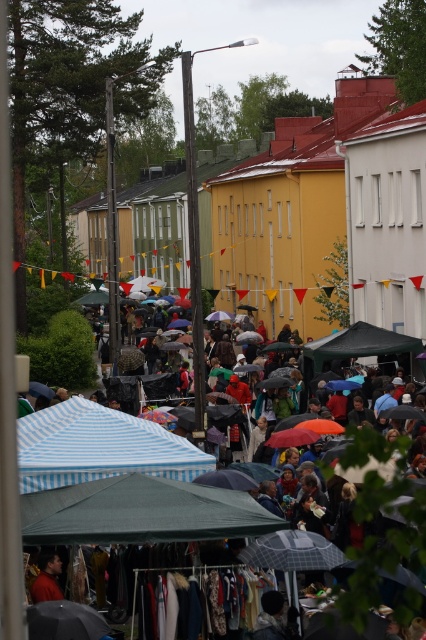
You are a customer at the market and want to buy a canopy for your own stall. You need one that is wider to cover more space. Based on the scene, which canopy should you choose between the green fabric canopy at lower center and the striped fabric tent at center?

The striped fabric tent at center is wider than the green fabric canopy at lower center, so you should choose the striped fabric tent at center.

You are a customer at the market and want to buy an umbrella. You notice two canopies, the green fabric canopy at lower center and the blue striped canopy at center. Which canopy is bigger?

The green fabric canopy at lower center is larger in size than the blue striped canopy at center, so the green fabric canopy at lower center is bigger.